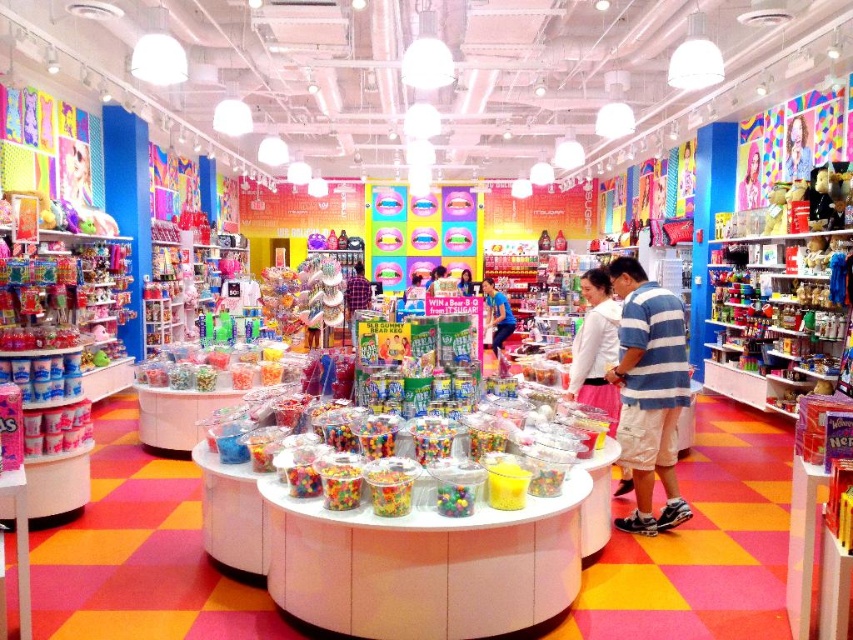
You are a customer in the candy store and want to pick up both the smooth plastic toy at center and the smooth pink dress at center. Which item do you need to reach further to get?

The smooth pink dress at center requires reaching further because it is farther from the viewer compared to the smooth plastic toy at center.